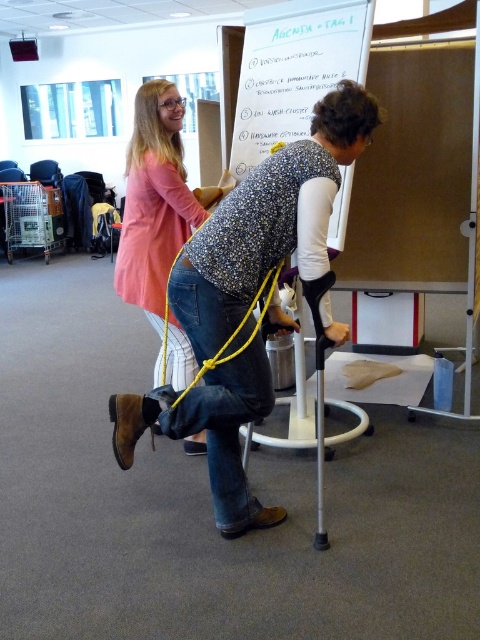
Question: Among these objects, which one is nearest to the camera?

Choices:
 (A) whiteboard at upper center
 (B) yellow string at center
 (C) matte pink sweater at upper left

Answer: (B)

Question: Which object is positioned farthest from the whiteboard at upper center?

Choices:
 (A) denim jeans at center
 (B) matte pink sweater at upper left

Answer: (A)

Question: Does matte pink sweater at upper left appear over yellow string at center?

Choices:
 (A) yes
 (B) no

Answer: (A)

Question: Is matte pink sweater at upper left above yellow string at center?

Choices:
 (A) no
 (B) yes

Answer: (B)

Question: Can you confirm if whiteboard at upper center is positioned to the right of matte pink sweater at upper left?

Choices:
 (A) no
 (B) yes

Answer: (B)

Question: Which is nearer to the matte pink sweater at upper left?

Choices:
 (A) whiteboard at upper center
 (B) denim jeans at center
 (C) yellow string at center

Answer: (C)